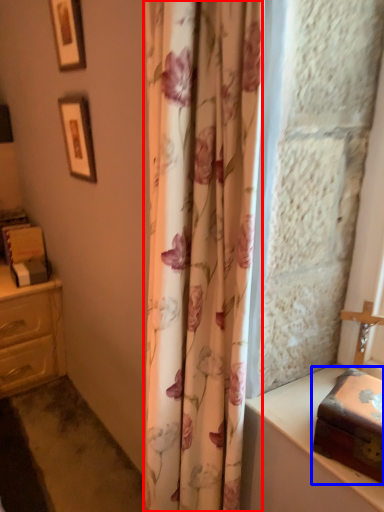
Question: Which of the following is the farthest to the observer, shower curtain (highlighted by a red box) or box (highlighted by a blue box)?

Choices:
 (A) shower curtain
 (B) box

Answer: (B)